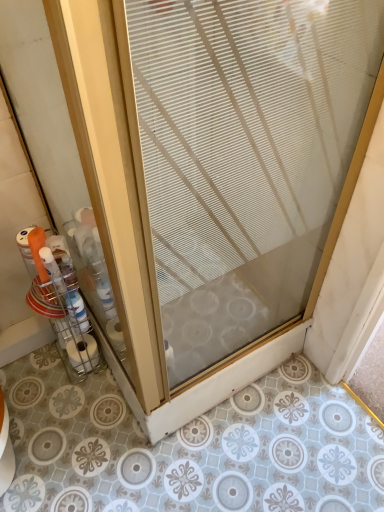
Question: Considering the relative sizes of white matte toilet paper at lower left and clear plastic container at left in the image provided, is white matte toilet paper at lower left smaller than clear plastic container at left?

Choices:
 (A) yes
 (B) no

Answer: (A)

Question: Is white matte toilet paper at lower left completely or partially outside of clear plastic container at left?

Choices:
 (A) no
 (B) yes

Answer: (A)

Question: Can you confirm if white matte toilet paper at lower left is taller than clear plastic container at left?

Choices:
 (A) no
 (B) yes

Answer: (A)

Question: Considering the relative positions of white matte toilet paper at lower left and clear plastic container at left in the image provided, is white matte toilet paper at lower left in front of clear plastic container at left?

Choices:
 (A) no
 (B) yes

Answer: (A)

Question: Is white matte toilet paper at lower left bigger than clear plastic container at left?

Choices:
 (A) no
 (B) yes

Answer: (A)

Question: From the image's perspective, is clear glass door at center positioned above or below clear plastic container at left?

Choices:
 (A) above
 (B) below

Answer: (A)

Question: Do you think clear glass door at center is within clear plastic container at left, or outside of it?

Choices:
 (A) outside
 (B) inside

Answer: (A)

Question: From their relative heights in the image, would you say clear glass door at center is taller or shorter than clear plastic container at left?

Choices:
 (A) tall
 (B) short

Answer: (A)

Question: Is clear glass door at center wider or thinner than clear plastic container at left?

Choices:
 (A) wide
 (B) thin

Answer: (A)

Question: Is clear plastic container at left spatially inside clear glass door at center, or outside of it?

Choices:
 (A) inside
 (B) outside

Answer: (B)

Question: In terms of height, does clear plastic container at left look taller or shorter compared to clear glass door at center?

Choices:
 (A) tall
 (B) short

Answer: (B)

Question: Considering the relative positions of clear plastic container at left and clear glass door at center in the image provided, is clear plastic container at left to the left or to the right of clear glass door at center?

Choices:
 (A) right
 (B) left

Answer: (B)

Question: From a real-world perspective, is clear plastic container at left above or below clear glass door at center?

Choices:
 (A) below
 (B) above

Answer: (A)

Question: From a real-world perspective, is white matte toilet paper at lower left physically located above or below clear glass door at center?

Choices:
 (A) above
 (B) below

Answer: (B)

Question: Considering the positions of white matte toilet paper at lower left and clear glass door at center in the image, is white matte toilet paper at lower left taller or shorter than clear glass door at center?

Choices:
 (A) tall
 (B) short

Answer: (B)